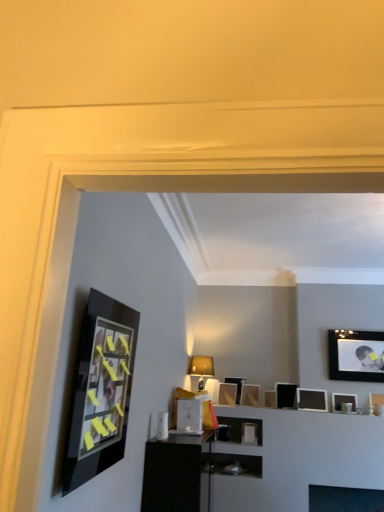
Question: Is matte black picture frame at upper right, placed as the fourth picture frame when sorted from back to front, looking in the opposite direction of matte black picture frame at center, placed as the 1th picture frame when sorted from back to front?

Choices:
 (A) yes
 (B) no

Answer: (B)

Question: Is matte black picture frame at upper right, the 6th picture frame positioned from the front, next to matte black picture frame at center, which is the 9th picture frame in front-to-back order?

Choices:
 (A) no
 (B) yes

Answer: (A)

Question: Can you confirm if matte black picture frame at upper right, placed as the fourth picture frame when sorted from back to front, is bigger than matte black picture frame at center, the 4th picture frame in the left-to-right sequence?

Choices:
 (A) no
 (B) yes

Answer: (B)

Question: Does matte black picture frame at upper right, the 6th picture frame positioned from the front, contain matte black picture frame at center, the 4th picture frame in the left-to-right sequence?

Choices:
 (A) yes
 (B) no

Answer: (B)

Question: Does matte black picture frame at upper right, the 6th picture frame positioned from the front, lie behind matte black picture frame at center, which is the 9th picture frame in front-to-back order?

Choices:
 (A) yes
 (B) no

Answer: (B)

Question: Does matte black picture frame at upper right, which is the 2th picture frame in right-to-left order, have a lesser width compared to matte black picture frame at center, the 4th picture frame in the left-to-right sequence?

Choices:
 (A) yes
 (B) no

Answer: (A)

Question: Is matte gold lampshade at center bigger than matte black picture frame at center, which ranks as the 5th picture frame in right-to-left order?

Choices:
 (A) no
 (B) yes

Answer: (B)

Question: Can matte black picture frame at center, the 5th picture frame viewed from the left, be found inside matte gold lampshade at center?

Choices:
 (A) yes
 (B) no

Answer: (B)

Question: Does matte gold lampshade at center have a greater height compared to matte black picture frame at center, which ranks as the 5th picture frame in right-to-left order?

Choices:
 (A) no
 (B) yes

Answer: (B)

Question: Is matte gold lampshade at center behind matte black picture frame at center, which ranks as the 5th picture frame in right-to-left order?

Choices:
 (A) no
 (B) yes

Answer: (A)

Question: From the image's perspective, is matte gold lampshade at center beneath matte black picture frame at center, which is the second picture frame from back to front?

Choices:
 (A) no
 (B) yes

Answer: (A)

Question: Is matte gold lampshade at center wider than matte black picture frame at center, which ranks as the 5th picture frame in right-to-left order?

Choices:
 (A) yes
 (B) no

Answer: (A)

Question: Is the surface of matte black picture frame at center, which is counted as the seventh picture frame, starting from the right, in direct contact with matte gold lampshade at center?

Choices:
 (A) yes
 (B) no

Answer: (B)